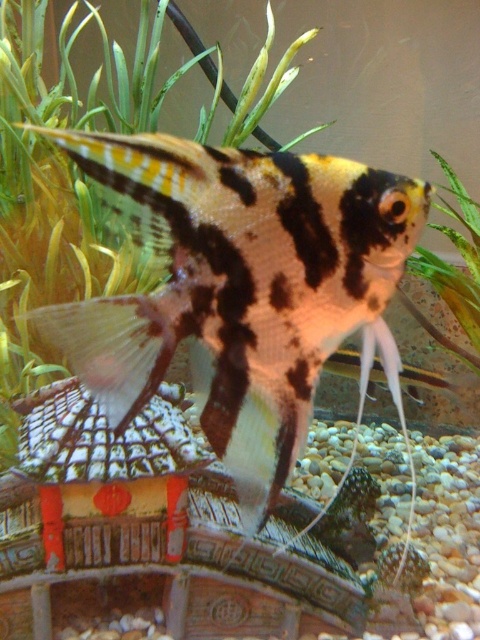
You are an aquarium maintenance worker who needs to clean the tank while keeping the fish safe. The black and white striped fish at center and the green leafy plant at center are in the way. Which object should you move first to create more space, considering their sizes?

The black and white striped fish at center has a smaller size compared to the green leafy plant at center, so you should move the black and white striped fish at center first to create more space.